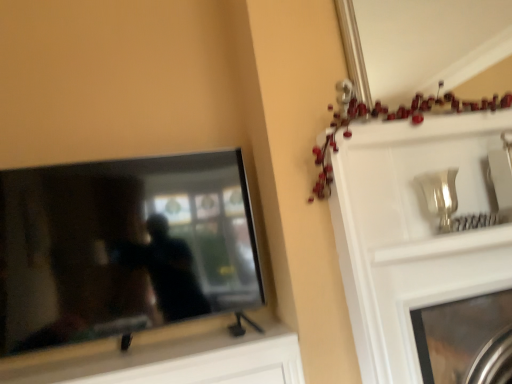
Question: From a real-world perspective, is matte black tv at left physically located above or below metallic silver fireplace at upper right?

Choices:
 (A) below
 (B) above

Answer: (B)

Question: Considering the positions of matte black tv at left and metallic silver fireplace at upper right in the image, is matte black tv at left bigger or smaller than metallic silver fireplace at upper right?

Choices:
 (A) big
 (B) small

Answer: (B)

Question: Which object is the farthest from the metallic garland at upper right?

Choices:
 (A) matte black tv at left
 (B) metallic silver fireplace at upper right
 (C) metallic silver mirror at upper center

Answer: (C)

Question: Estimate the real-world distances between objects in this image. Which object is closer to the metallic silver mirror at upper center?

Choices:
 (A) matte black tv at left
 (B) metallic silver fireplace at upper right
 (C) metallic garland at upper right

Answer: (C)